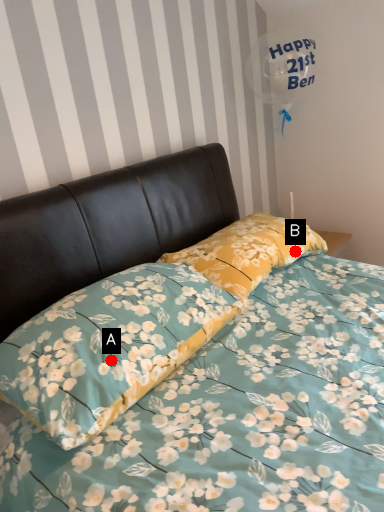
Question: Two points are circled on the image, labeled by A and B beside each circle. Which of the following is the farthest from the observer?

Choices:
 (A) A is further
 (B) B is further

Answer: (B)